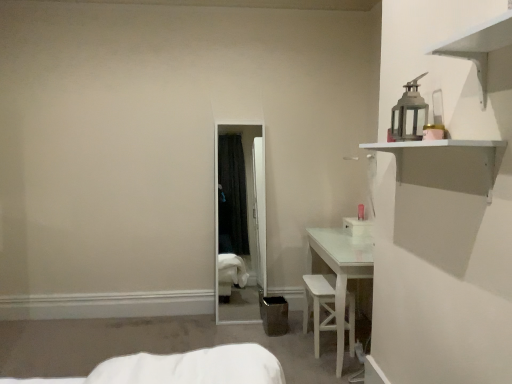
Question: From a real-world perspective, is white matte shelf at upper right physically below white wood chair at lower center?

Choices:
 (A) yes
 (B) no

Answer: (B)

Question: Is white matte shelf at upper right aimed at white wood chair at lower center?

Choices:
 (A) no
 (B) yes

Answer: (A)

Question: From the image's perspective, would you say white matte shelf at upper right is shown under white wood chair at lower center?

Choices:
 (A) yes
 (B) no

Answer: (B)

Question: Is white matte shelf at upper right placed right next to white wood chair at lower center?

Choices:
 (A) no
 (B) yes

Answer: (A)

Question: Does white matte shelf at upper right have a smaller size compared to white wood chair at lower center?

Choices:
 (A) yes
 (B) no

Answer: (A)

Question: Is white matte shelf at upper right bigger than white wood chair at lower center?

Choices:
 (A) yes
 (B) no

Answer: (B)

Question: From a real-world perspective, is white wood chair at lower center below white matte shelf at upper right?

Choices:
 (A) yes
 (B) no

Answer: (A)

Question: Considering the relative positions of white wood chair at lower center and white matte shelf at upper right in the image provided, is white wood chair at lower center to the left of white matte shelf at upper right from the viewer's perspective?

Choices:
 (A) no
 (B) yes

Answer: (B)

Question: Is white wood chair at lower center wider than white matte shelf at upper right?

Choices:
 (A) yes
 (B) no

Answer: (A)

Question: Does white wood chair at lower center have a lesser width compared to white matte shelf at upper right?

Choices:
 (A) yes
 (B) no

Answer: (B)

Question: From the image's perspective, is white wood chair at lower center under white matte shelf at upper right?

Choices:
 (A) no
 (B) yes

Answer: (B)

Question: Does white wood chair at lower center appear on the right side of white matte shelf at upper right?

Choices:
 (A) no
 (B) yes

Answer: (A)

Question: From the image's perspective, is white matte shelf at upper right located above or below white wood chair at lower center?

Choices:
 (A) above
 (B) below

Answer: (A)